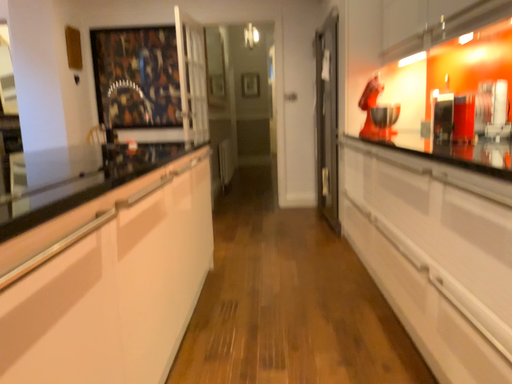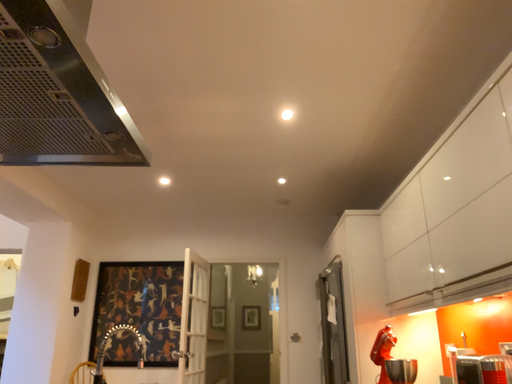
Question: How did the camera likely rotate when shooting the video?

Choices:
 (A) rotated upward
 (B) rotated downward

Answer: (A)